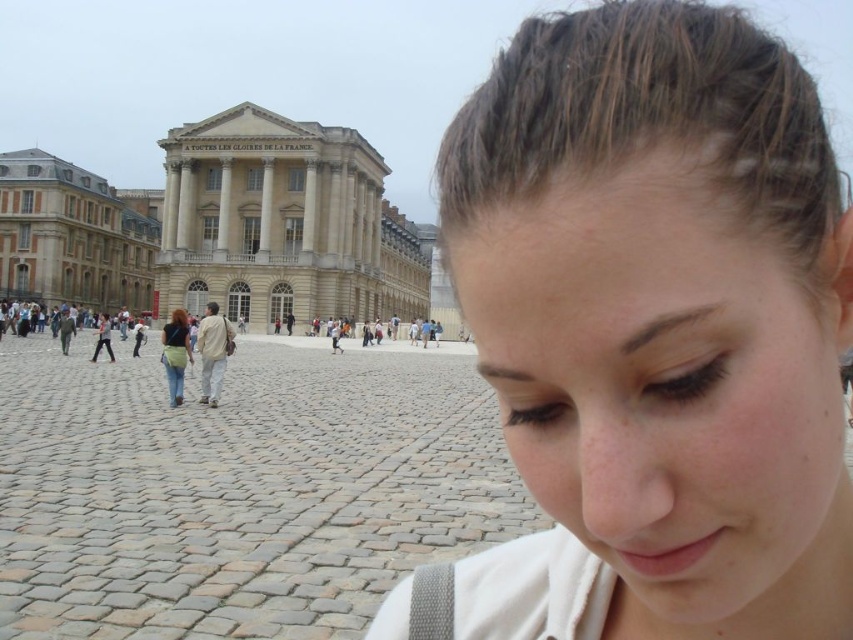
Between denim jacket at center and matte gray pants at center, which one has more height?

With more height is denim jacket at center.

Is denim jacket at center closer to the viewer compared to matte gray pants at center?

Yes.

Between point (177, 337) and point (109, 326), which one is positioned behind?

Positioned behind is point (109, 326).

This screenshot has height=640, width=853. I want to click on denim jacket at center, so click(175, 353).

Is beige stone building at center behind denim jacket at center?

Yes, beige stone building at center is behind denim jacket at center.

Can you confirm if beige stone building at center is positioned above denim jacket at center?

Correct, beige stone building at center is located above denim jacket at center.

Measure the distance between point (3, 184) and camera.

They are 423.09 feet apart.

In order to click on beige stone building at center in this screenshot , I will do `click(73, 236)`.

Is smooth brown hair at center positioned behind denim jacket at center?

No, it is in front of denim jacket at center.

Is smooth brown hair at center smaller than denim jacket at center?

No, smooth brown hair at center is not smaller than denim jacket at center.

Locate an element on the screen. Image resolution: width=853 pixels, height=640 pixels. smooth brown hair at center is located at coordinates (659, 323).